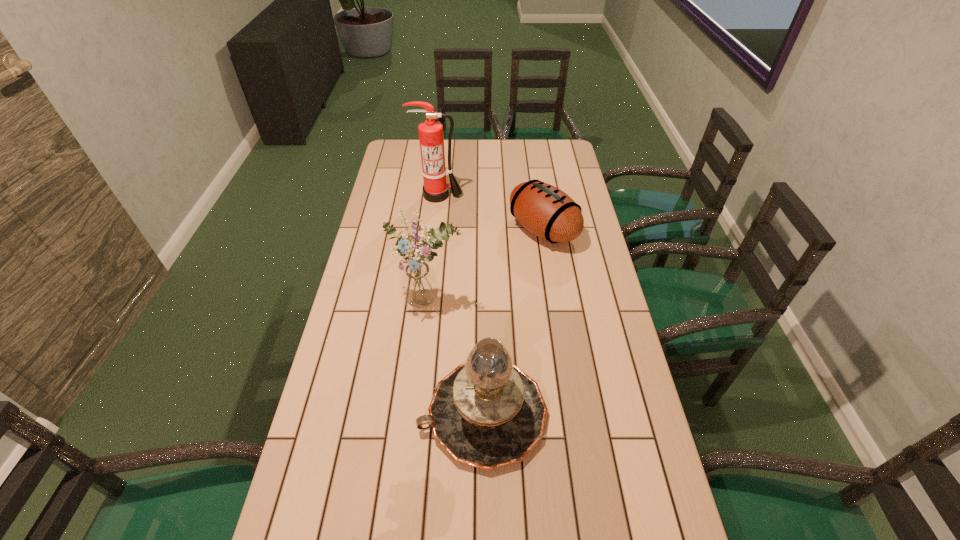
I want to click on vacant area between the third farthest object and the shortest object, so click(x=486, y=266).

Locate an element on the screen. The height and width of the screenshot is (540, 960). unoccupied position between the oil lamp and the bouquet is located at coordinates (456, 358).

Find the location of a particular element. object that is the closest to the third tallest object is located at coordinates (418, 282).

Identify which object is the second nearest to the farthest object. Please provide its 2D coordinates. Your answer should be formatted as a tuple, i.e. [(x, y)], where the tuple contains the x and y coordinates of a point satisfying the conditions above.

[(418, 282)]

Where is `free region that satisfies the following two spatial constraints: 1. at the nozzle of the farthest object; 2. on the right side of the third nearest object`? The height and width of the screenshot is (540, 960). free region that satisfies the following two spatial constraints: 1. at the nozzle of the farthest object; 2. on the right side of the third nearest object is located at coordinates (434, 230).

Locate an element on the screen. vacant space that satisfies the following two spatial constraints: 1. on the front-facing side of the nearest object; 2. on the right side of the second nearest object is located at coordinates (417, 414).